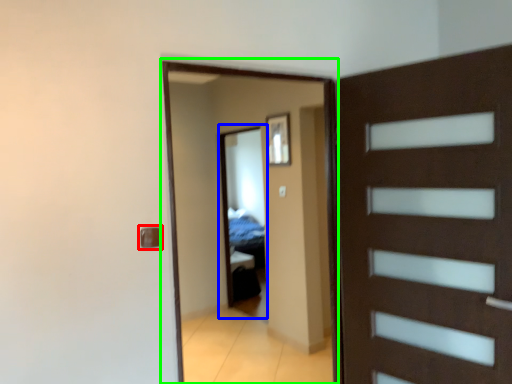
Question: Based on their relative distances, which object is nearer to door handle (highlighted by a red box)? Choose from mirror (highlighted by a blue box) and screen door (highlighted by a green box).

Choices:
 (A) mirror
 (B) screen door

Answer: (B)